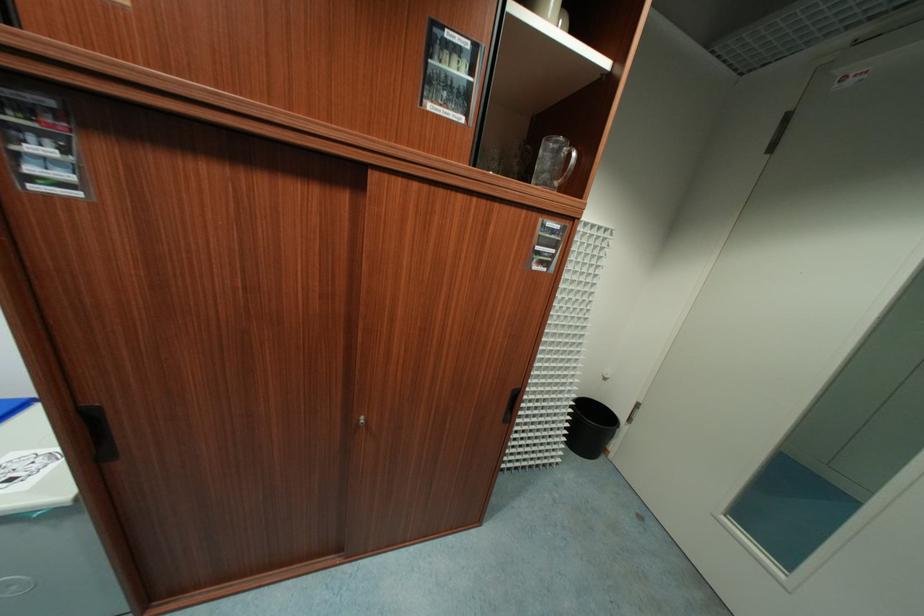
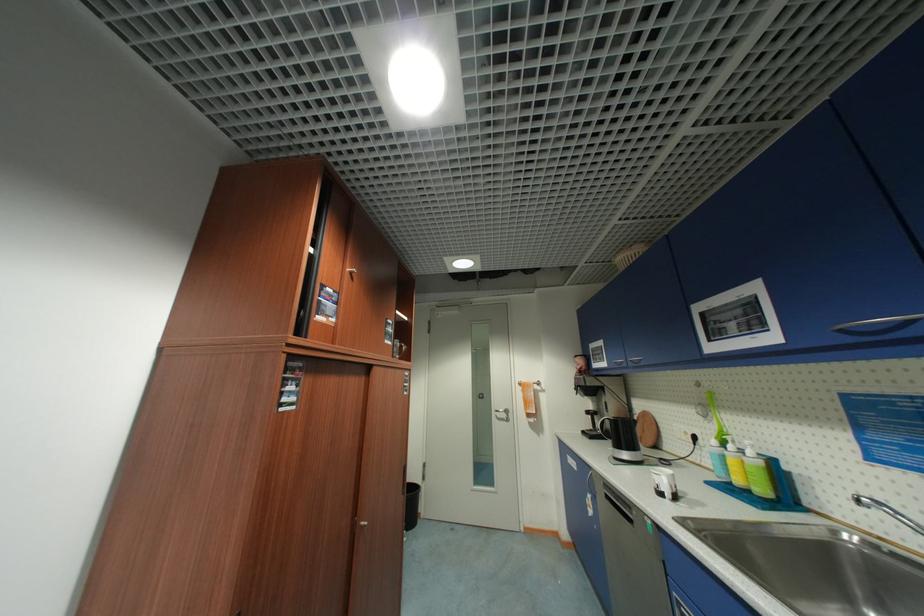
Find the pixel in the second image that matches [598,424] in the first image.

(418, 493)